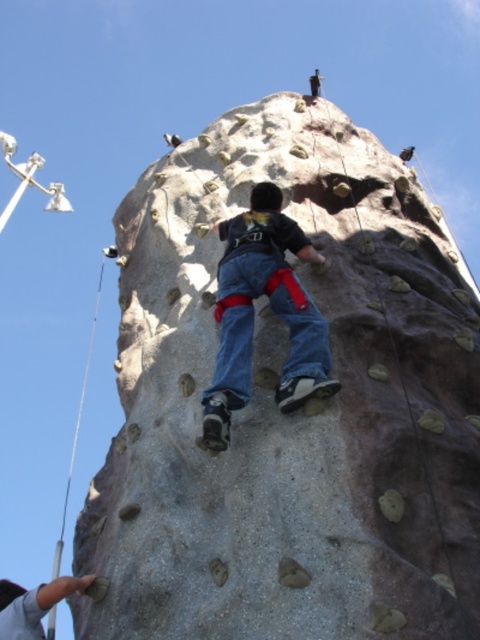
Question: Can you confirm if gray rough climbing rock at center is positioned to the left of denim jeans at center?

Choices:
 (A) no
 (B) yes

Answer: (B)

Question: Which object is farther from the camera taking this photo?

Choices:
 (A) denim jeans at center
 (B) gray rough climbing rock at center

Answer: (A)

Question: From the image, what is the correct spatial relationship of gray rough climbing rock at center in relation to denim jeans at center?

Choices:
 (A) above
 (B) below

Answer: (A)

Question: Which object is closer to the camera taking this photo?

Choices:
 (A) gray rough climbing rock at center
 (B) denim jeans at center

Answer: (A)

Question: From the image, what is the correct spatial relationship of gray rough climbing rock at center in relation to denim jeans at center?

Choices:
 (A) left
 (B) right

Answer: (A)